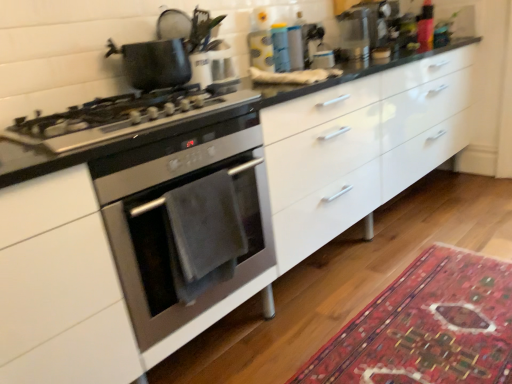
Find the location of a particular element. This screenshot has height=384, width=512. free spot above carpet with intricate patterns at lower right (from a real-world perspective) is located at coordinates (435, 313).